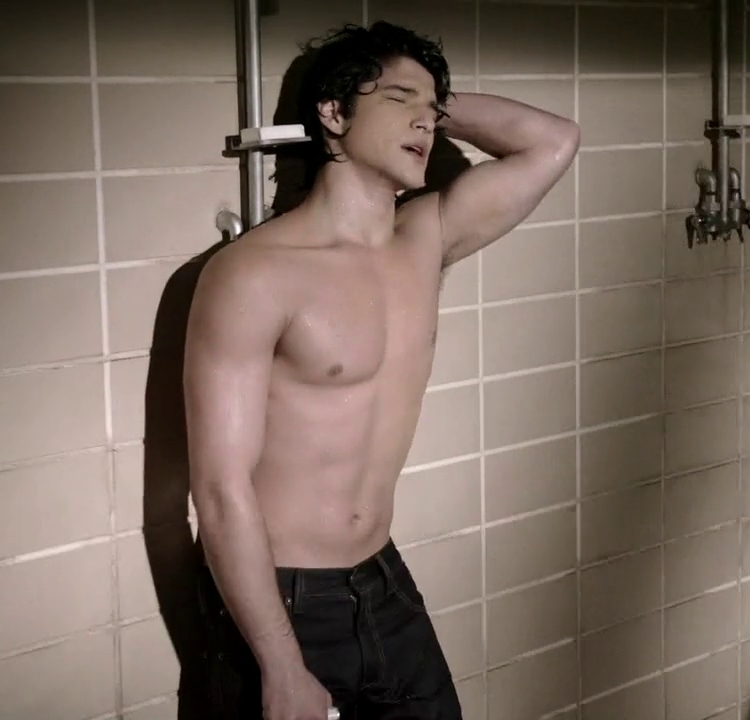
Identify the location of knobs. (700, 217), (739, 219).